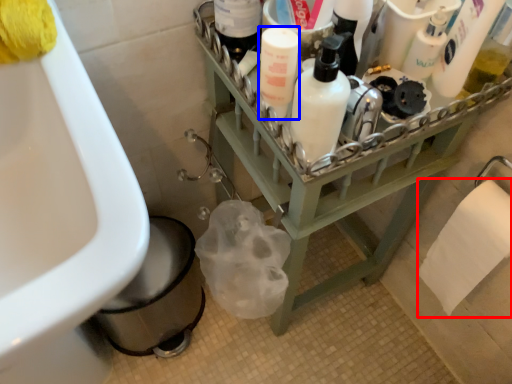
Question: Which of the following is the farthest to the observer, toilet paper (highlighted by a red box) or cleaning product (highlighted by a blue box)?

Choices:
 (A) toilet paper
 (B) cleaning product

Answer: (A)